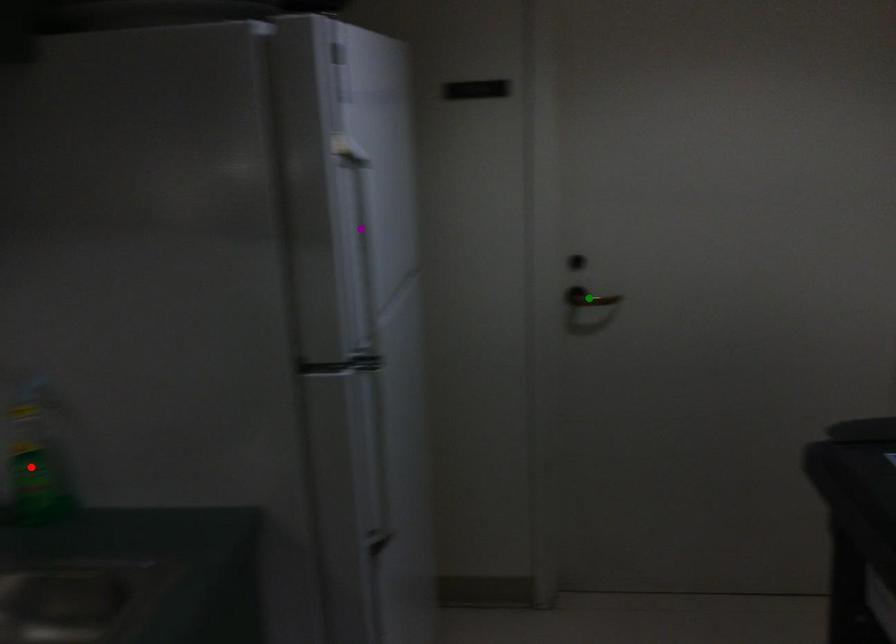
Order these from nearest to farthest:
A) red point
B) green point
C) purple point

purple point < red point < green point